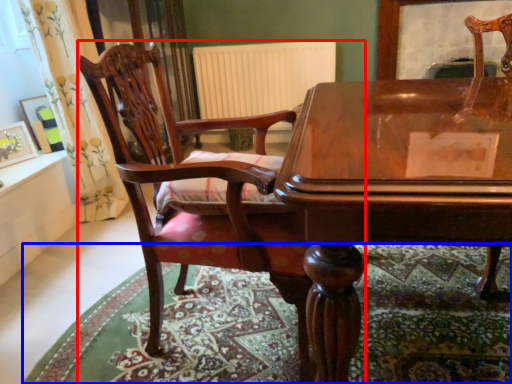
Question: Which of the following is the farthest to the observer, chair (highlighted by a red box) or mat (highlighted by a blue box)?

Choices:
 (A) chair
 (B) mat

Answer: (B)